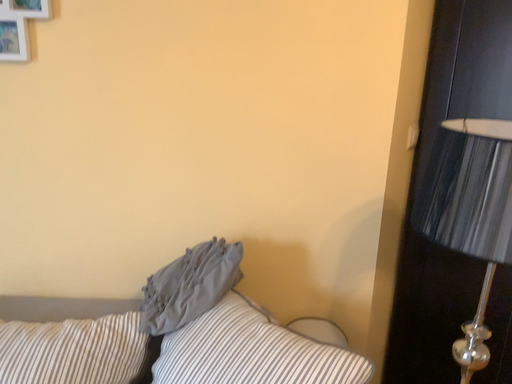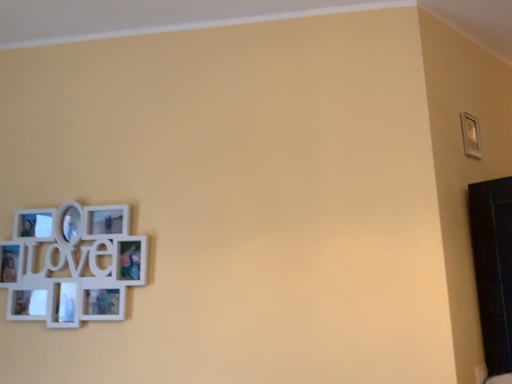
Question: How did the camera likely rotate when shooting the video?

Choices:
 (A) rotated downward
 (B) rotated upward

Answer: (B)